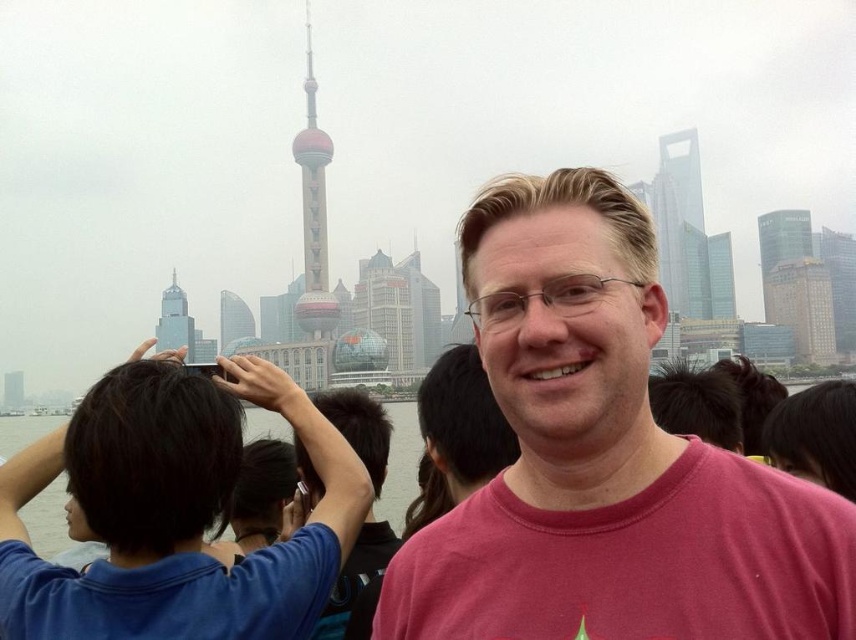
Between shiny glass tower at center and glassy reflective skyscraper at center, which one has more height?

shiny glass tower at center is taller.

Does point (319, 220) come farther from viewer compared to point (227, 332)?

No, it is not.

Does point (311, 285) lie in front of point (247, 339)?

Yes, point (311, 285) is in front of point (247, 339).

Locate an element on the screen. shiny glass tower at center is located at coordinates (313, 211).

Between pink cotton t-shirt at center and dark blue fabric at left, which one appears on the left side from the viewer's perspective?

From the viewer's perspective, dark blue fabric at left appears more on the left side.

Measure the distance between point (515,340) and camera.

Point (515,340) and camera are 359.24 meters apart.

Locate an element on the screen. pink cotton t-shirt at center is located at coordinates (605, 460).

Who is higher up, pink cotton t-shirt at center or glassy beige skyscraper at center-right?

Positioned higher is glassy beige skyscraper at center-right.

Is pink cotton t-shirt at center positioned in front of glassy beige skyscraper at center-right?

Yes, it is in front of glassy beige skyscraper at center-right.

This screenshot has height=640, width=856. What do you see at coordinates (605, 460) in the screenshot?
I see `pink cotton t-shirt at center` at bounding box center [605, 460].

Locate an element on the screen. pink cotton t-shirt at center is located at coordinates (605, 460).